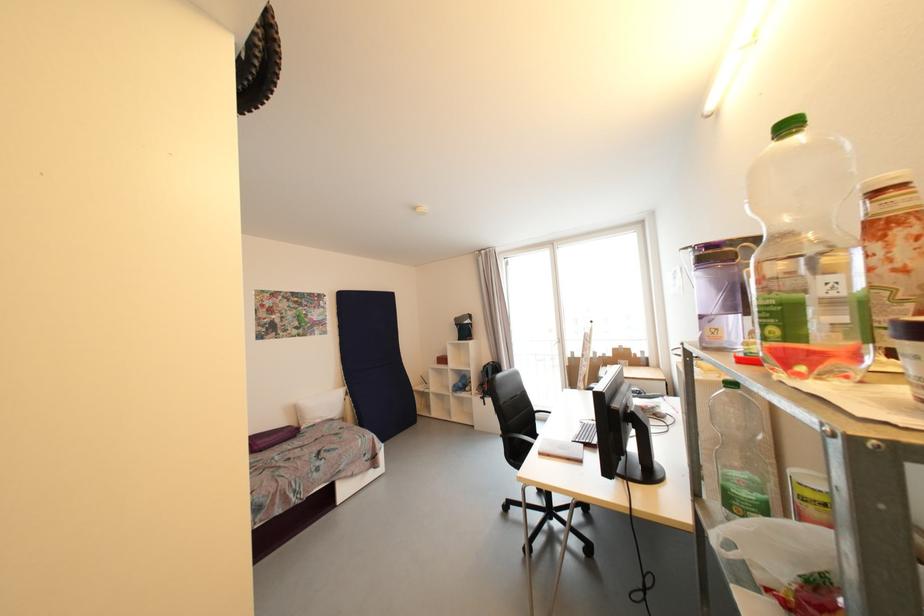
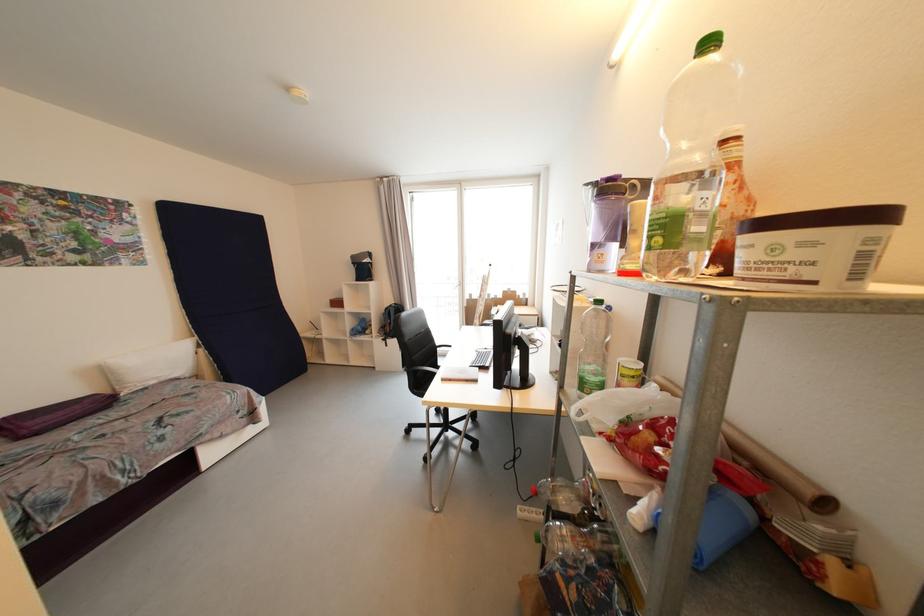
Question: The camera is either moving clockwise (left) or counter-clockwise (right) around the object. The first image is from the beginning of the video and the second image is from the end. Is the camera moving left or right when shooting the video?

Choices:
 (A) Left
 (B) Right

Answer: (A)